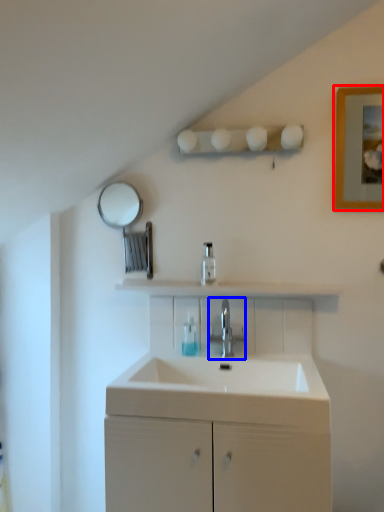
Question: Which object appears closest to the camera in this image, picture frame (highlighted by a red box) or tap (highlighted by a blue box)?

Choices:
 (A) picture frame
 (B) tap

Answer: (A)